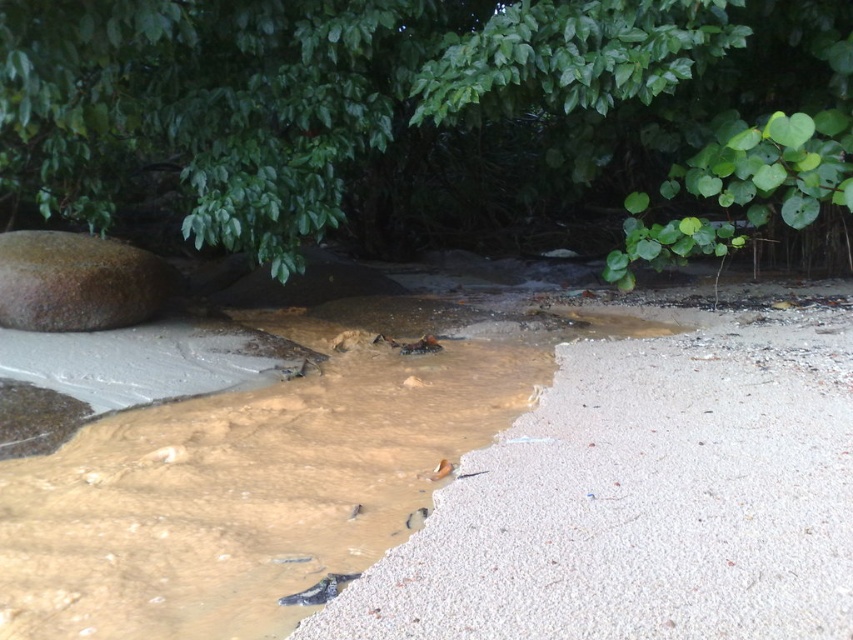
Question: Which object appears closest to the camera in this image?

Choices:
 (A) brown sandy beach at center
 (B) green leafy tree at upper center
 (C) brown muddy water at center

Answer: (A)

Question: Is brown muddy water at center to the right of brown rough boulder at left from the viewer's perspective?

Choices:
 (A) no
 (B) yes

Answer: (B)

Question: Which object is farther from the camera taking this photo?

Choices:
 (A) green leafy tree at upper center
 (B) brown sandy beach at center
 (C) brown rough boulder at left
 (D) brown muddy water at center

Answer: (C)

Question: Is green leafy tree at upper center thinner than brown rough boulder at left?

Choices:
 (A) yes
 (B) no

Answer: (B)

Question: Which point is farther to the camera?

Choices:
 (A) green leafy tree at upper center
 (B) brown sandy beach at center
 (C) brown muddy water at center

Answer: (A)

Question: Is brown sandy beach at center to the right of brown muddy water at center from the viewer's perspective?

Choices:
 (A) yes
 (B) no

Answer: (A)